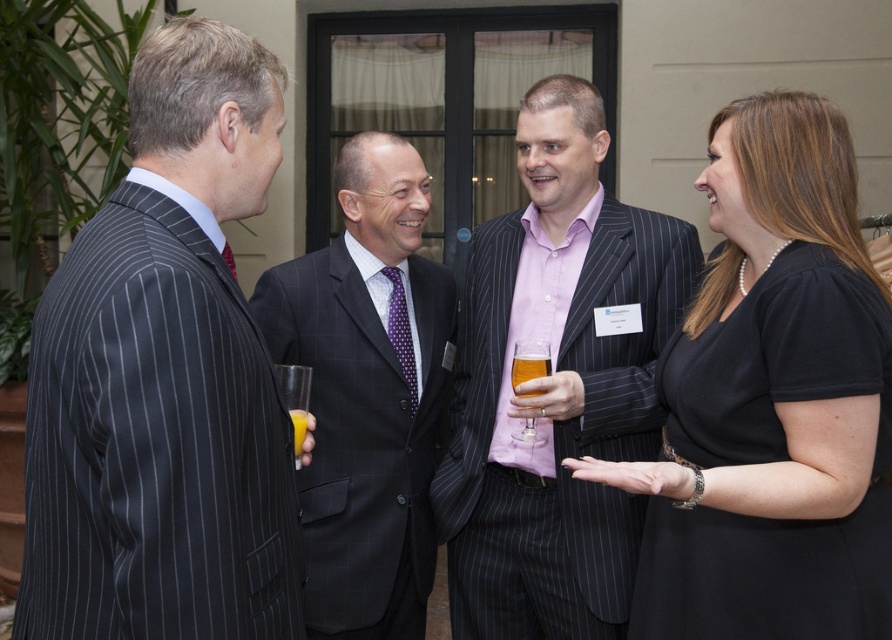
Question: Can you confirm if dark gray pinstripe suit at left is wider than black matte dress at center?

Choices:
 (A) yes
 (B) no

Answer: (B)

Question: Considering the real-world distances, which object is farthest from the translucent glass orange juice at lower left?

Choices:
 (A) pink striped suit at center
 (B) black matte dress at center
 (C) dark gray pinstripe suit at left
 (D) dark gray pinstripe suit at center

Answer: (B)

Question: Which of the following is the closest to the observer?

Choices:
 (A) (736, 250)
 (B) (303, 280)
 (C) (521, 355)

Answer: (A)

Question: Which point is farther from the camera taking this photo?

Choices:
 (A) (295, 452)
 (B) (808, 608)
 (C) (471, 388)

Answer: (C)

Question: Is pink striped suit at center further to camera compared to translucent glass at center?

Choices:
 (A) no
 (B) yes

Answer: (A)

Question: Considering the relative positions of pink striped suit at center and translucent glass at center in the image provided, where is pink striped suit at center located with respect to translucent glass at center?

Choices:
 (A) below
 (B) above

Answer: (A)